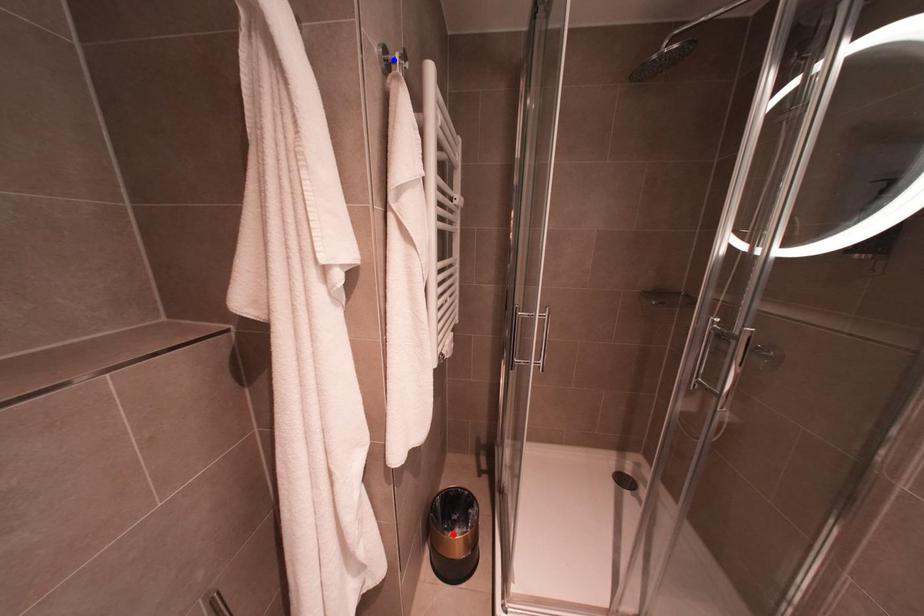
Question: In the image, two points are highlighted. Which point is nearer to the camera? Reply with the corresponding letter.

Choices:
 (A) blue point
 (B) red point

Answer: (A)